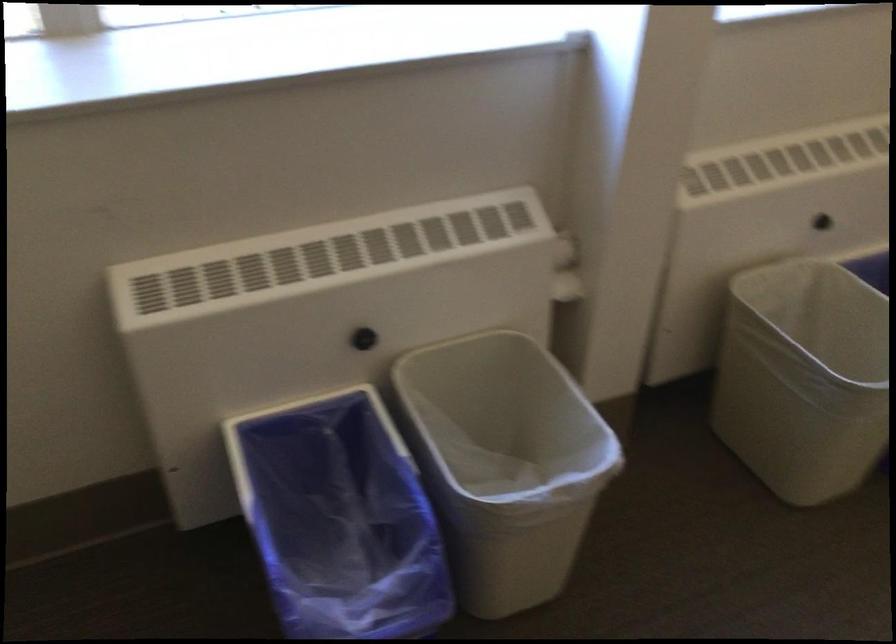
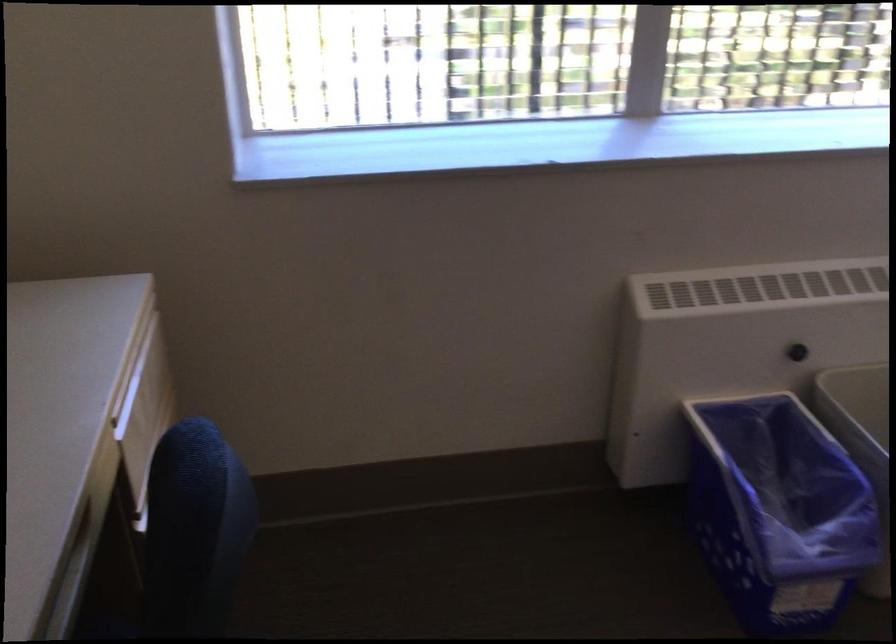
In the second image, find the point that corresponds to point (364, 342) in the first image.

(796, 352)